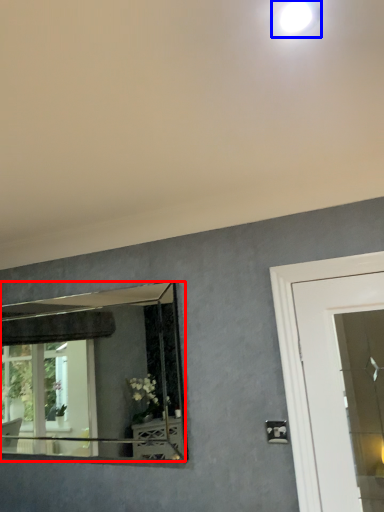
Question: Which object is further to the camera taking this photo, mirror (highlighted by a red box) or droplight (highlighted by a blue box)?

Choices:
 (A) mirror
 (B) droplight

Answer: (A)